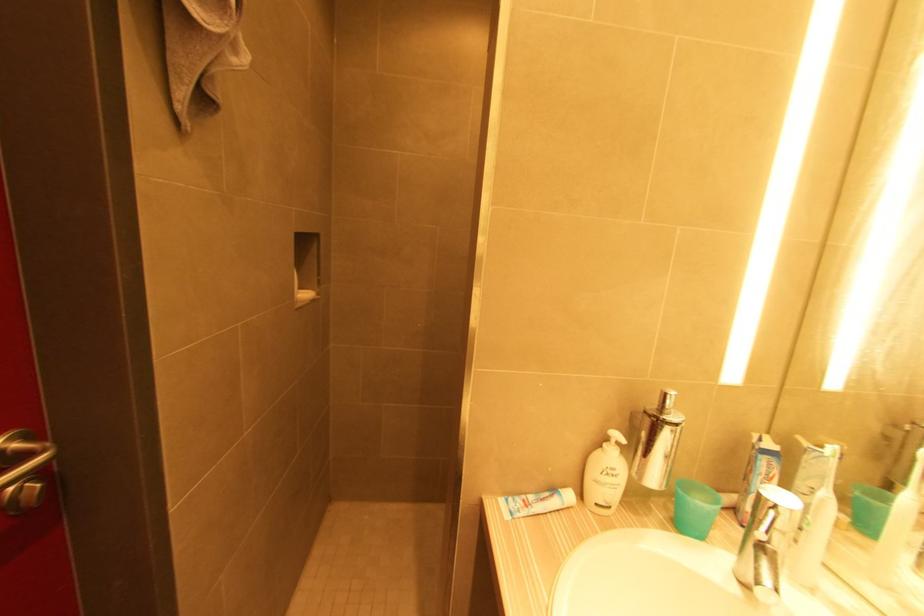
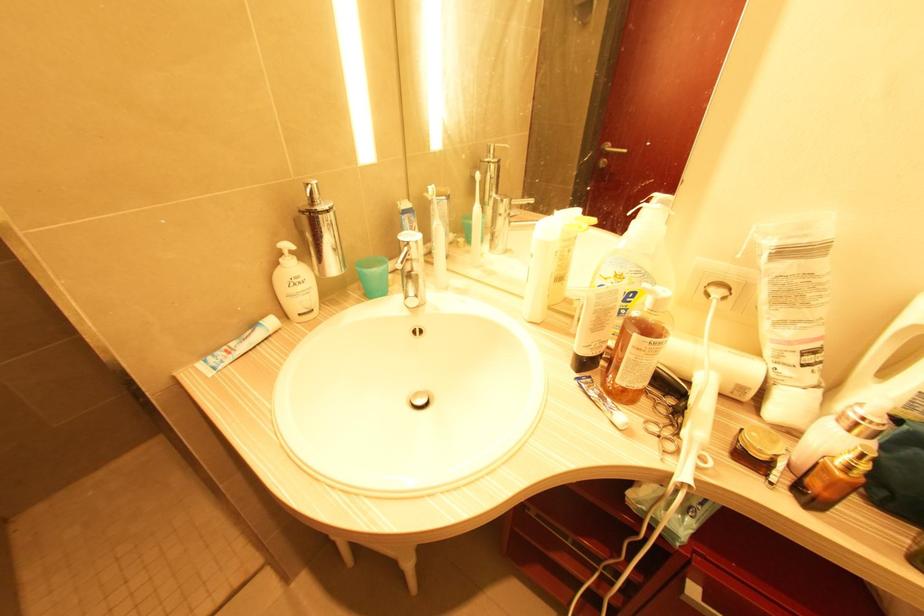
Locate, in the second image, the point that corresponds to point 526,498 in the first image.

(226, 349)